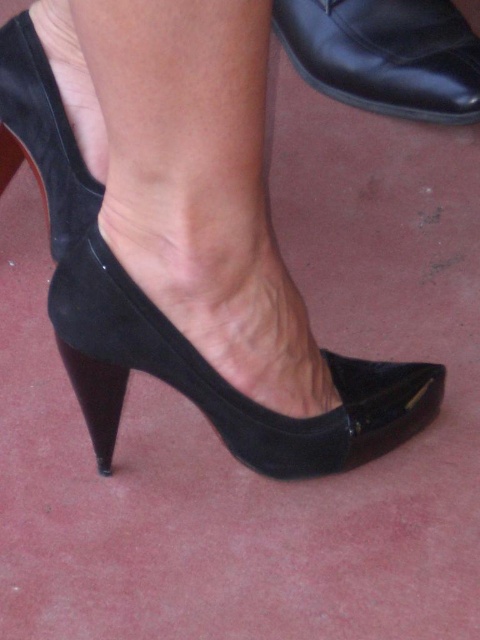
In the scene shown: Does suede black high-heeled shoe at center have a greater height compared to black suede shoe at upper right?

Yes, suede black high-heeled shoe at center is taller than black suede shoe at upper right.

Which is in front, point (261, 77) or point (444, 106)?

Point (261, 77)

Identify the location of suede black high-heeled shoe at center. (183, 234).